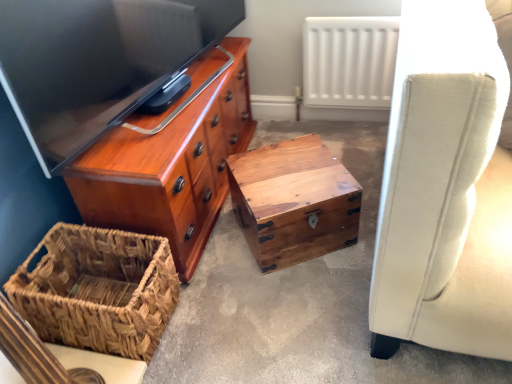
The image size is (512, 384). Find the location of `blank space to the left of natural wood trunk at center`. blank space to the left of natural wood trunk at center is located at coordinates (220, 248).